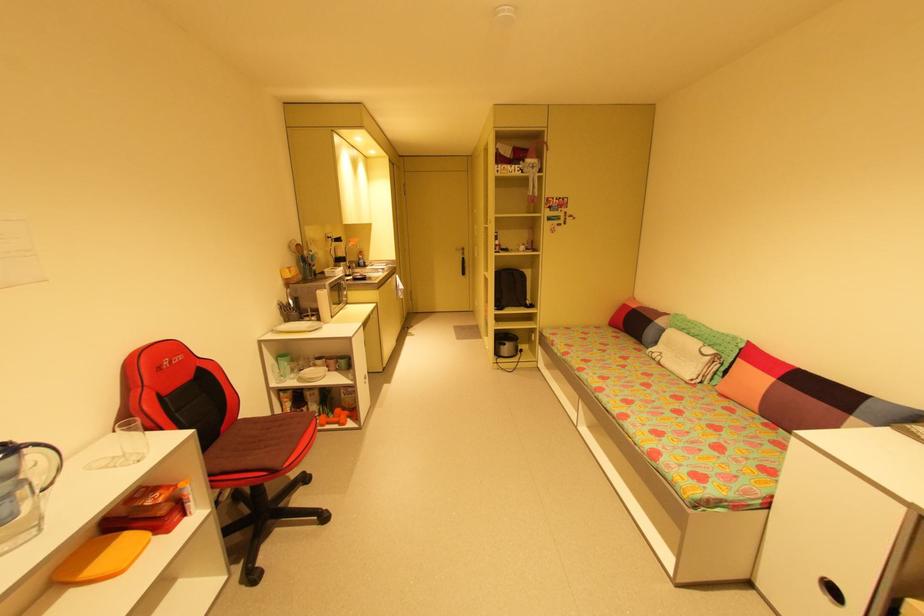
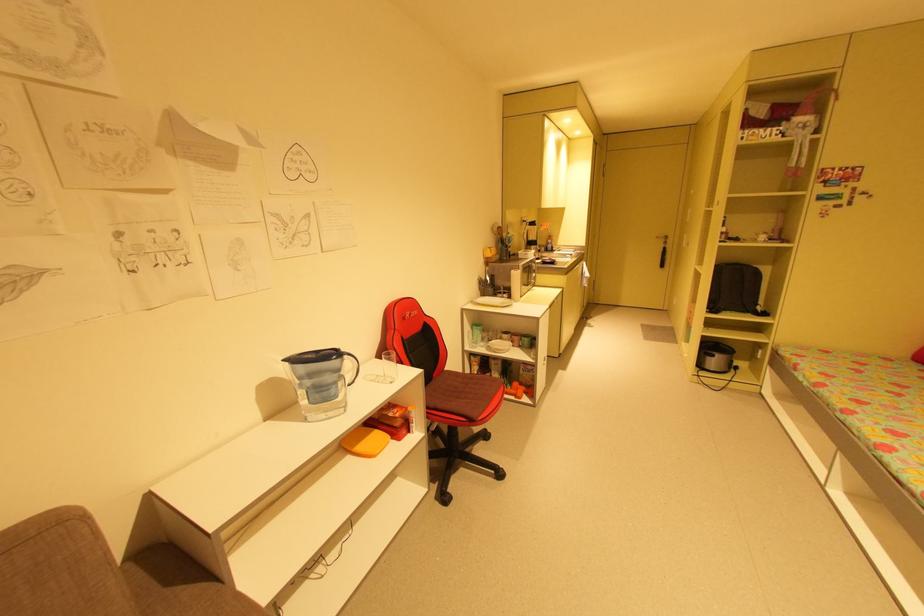
Question: The images are taken continuously from a first-person perspective. In which direction is your viewpoint rotating?

Choices:
 (A) Left
 (B) Right
 (C) Up
 (D) Down

Answer: (A)